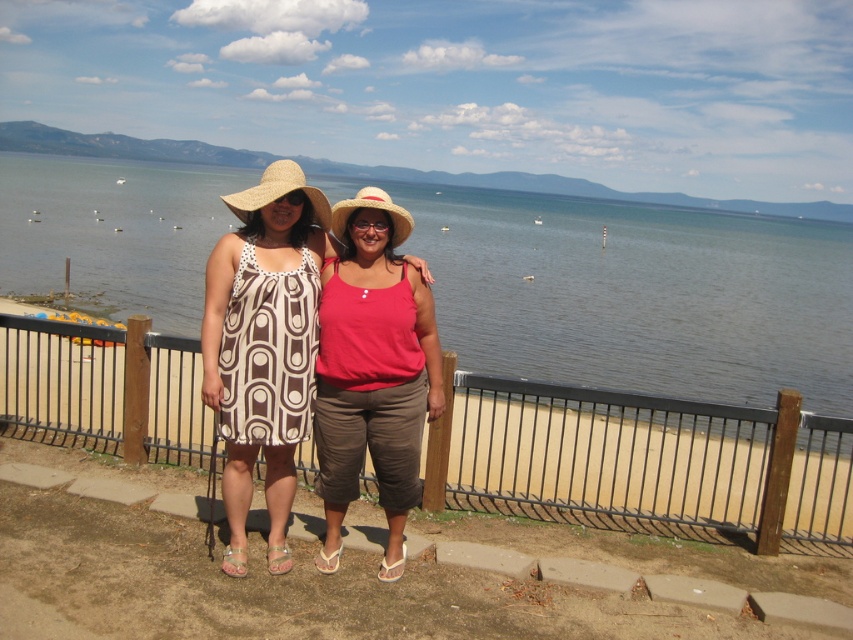
You are a photographer planning to take a photo of the two people in the scene. The camera you are using has a limited frame width. Considering the brown textured dress at center and the matte pink tank top at center, which clothing item will require more horizontal space in the frame?

The brown textured dress at center requires more horizontal space in the frame because its width is larger than the matte pink tank top at center.

You are standing at the center of the image and want to reach the blue water at center. According to the coordinates provided, in which direction should you move?

The blue water at center is located at coordinates point (636, 294). Since you are at the center of the image, you should move downward to reach it because the y coordinate 0.747 is below the center point.